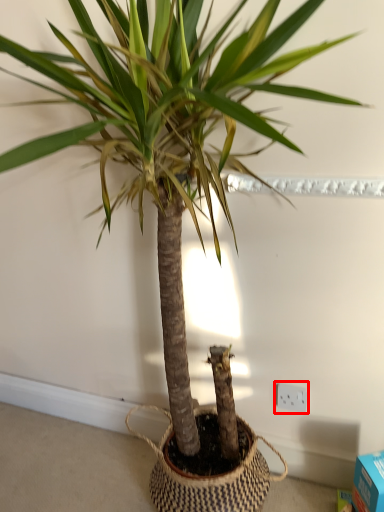
Question: From the image's perspective, what is the correct spatial relationship of electric outlet (annotated by the red box) in relation to box?

Choices:
 (A) above
 (B) below

Answer: (A)